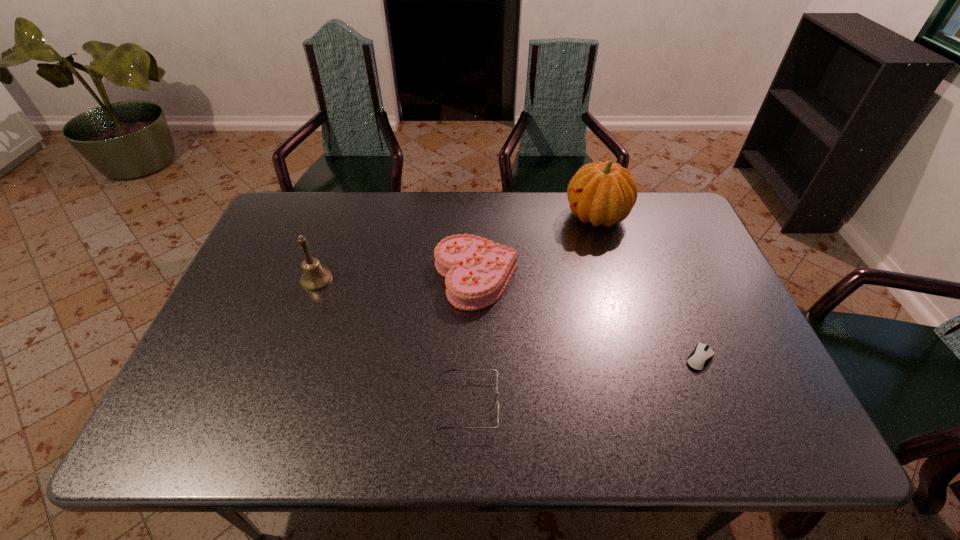
Where is `vacant point located on the carved face of the pumpkin`? The width and height of the screenshot is (960, 540). vacant point located on the carved face of the pumpkin is located at coordinates (492, 216).

You are a GUI agent. You are given a task and a screenshot of the screen. Output one action in this format:
    pyautogui.click(x=<x>, y=<y>)
    Task: Click on the free region located on the carved face of the pumpkin
    
    Given the screenshot: What is the action you would take?
    pyautogui.click(x=452, y=216)

In order to click on free space located 0.210m on the right of the leftmost object in this screenshot , I will do `click(407, 279)`.

The width and height of the screenshot is (960, 540). In order to click on free space located 0.260m on the front of the third shortest object in this screenshot , I will do 475,401.

You are a GUI agent. You are given a task and a screenshot of the screen. Output one action in this format:
    pyautogui.click(x=<x>, y=<y>)
    Task: Click on the blank space located on the front-facing side of the nearest object
    Image resolution: width=960 pixels, height=540 pixels.
    Given the screenshot: What is the action you would take?
    pyautogui.click(x=630, y=403)

You are a GUI agent. You are given a task and a screenshot of the screen. Output one action in this format:
    pyautogui.click(x=<x>, y=<y>)
    Task: Click on the vacant space located on the left of the mouse
    The width and height of the screenshot is (960, 540).
    Given the screenshot: What is the action you would take?
    point(664,358)

At what (x,y) coordinates should I click in order to perform the action: click on object that is at the far edge. Please return your answer as a coordinate pair (x, y). Image resolution: width=960 pixels, height=540 pixels. Looking at the image, I should click on (602, 193).

Identify the location of object at the near edge. The width and height of the screenshot is (960, 540). (448, 370).

The width and height of the screenshot is (960, 540). I want to click on object located in the right edge section of the desktop, so click(x=701, y=356).

This screenshot has height=540, width=960. Find the location of `vacant region at the far edge of the desktop`. vacant region at the far edge of the desktop is located at coordinates (538, 230).